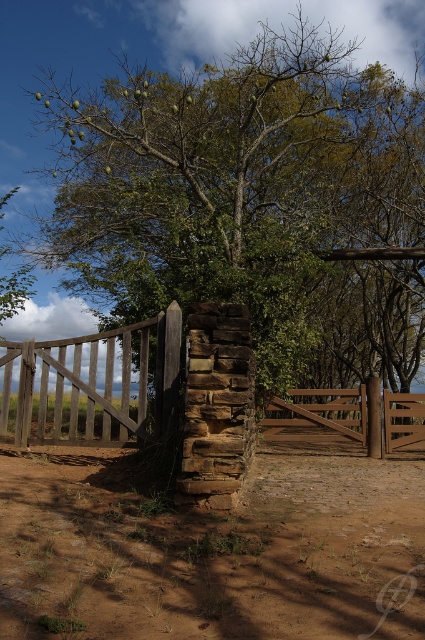
Question: Among these points, which one is nearest to the camera?

Choices:
 (A) (224, 458)
 (B) (346, 593)
 (C) (342, 278)

Answer: (B)

Question: Estimate the real-world distances between objects in this image. Which object is closer to the brown wooden gate at center?

Choices:
 (A) brown dirt field at center
 (B) green leafy tree at center

Answer: (A)

Question: Can you confirm if green leafy tree at center is positioned to the right of brown wooden gate at center?

Choices:
 (A) yes
 (B) no

Answer: (A)

Question: Which point appears closest to the camera in this image?

Choices:
 (A) (374, 412)
 (B) (271, 72)
 (C) (214, 604)

Answer: (C)

Question: Is brown dirt field at center to the right of brown wooden gate at center from the viewer's perspective?

Choices:
 (A) yes
 (B) no

Answer: (A)

Question: Can you confirm if green leafy tree at center is positioned above brown wooden gate at center?

Choices:
 (A) no
 (B) yes

Answer: (B)